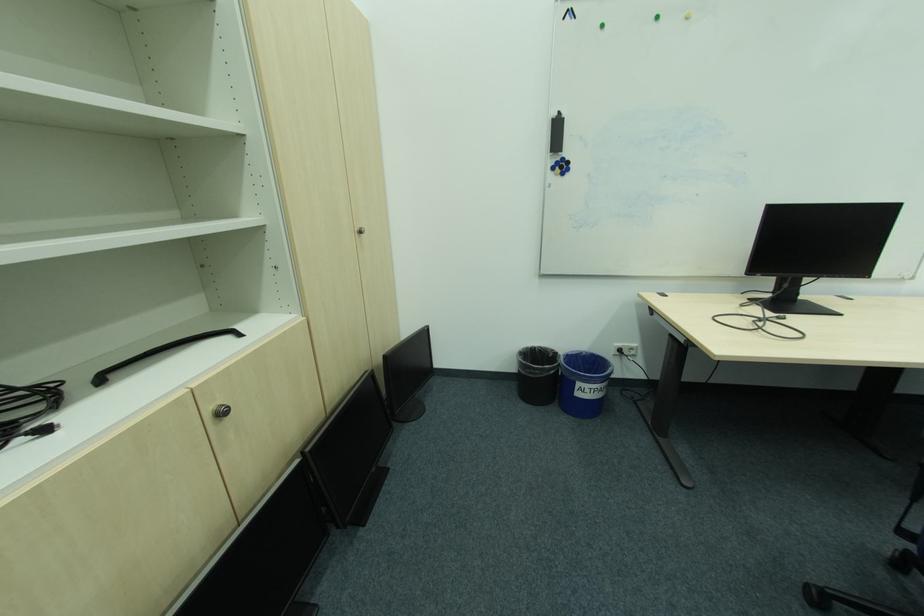
The height and width of the screenshot is (616, 924). What are the coordinates of `yellow round magnet` in the screenshot? It's located at (687, 15).